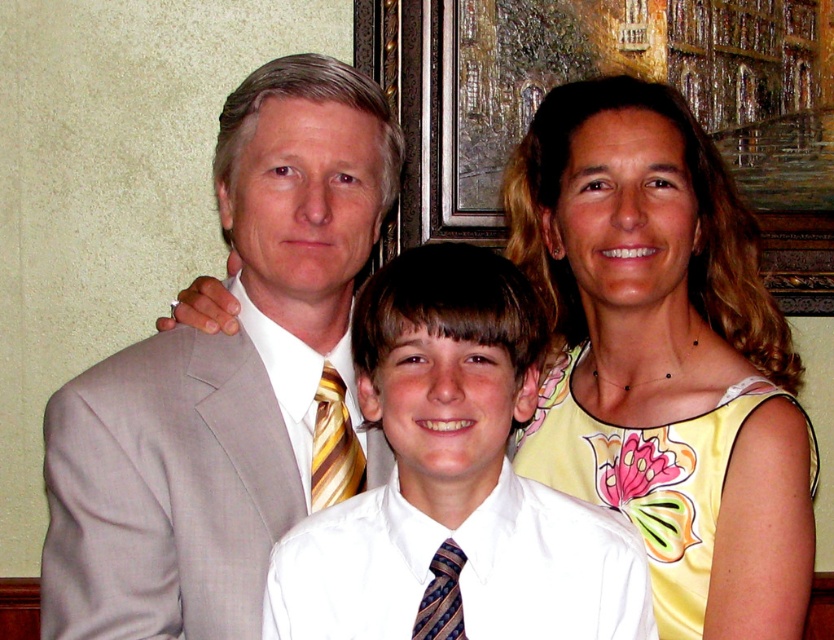
Is white satin shirt at center positioned behind multicolored silk tie at center?

No, white satin shirt at center is in front of multicolored silk tie at center.

Is white satin shirt at center taller than multicolored silk tie at center?

Yes.

I want to click on white satin shirt at center, so click(x=455, y=477).

Is light gray suit at center below yellow striped tie at center?

Incorrect, light gray suit at center is not positioned below yellow striped tie at center.

Can you confirm if light gray suit at center is positioned to the left of yellow striped tie at center?

Yes, light gray suit at center is to the left of yellow striped tie at center.

Find the location of a particular element. This screenshot has width=834, height=640. light gray suit at center is located at coordinates (220, 378).

This screenshot has height=640, width=834. In order to click on light gray suit at center in this screenshot , I will do `click(220, 378)`.

Consider the image. Does light gray suit at center have a smaller size compared to white satin shirt at center?

Actually, light gray suit at center might be larger than white satin shirt at center.

Between light gray suit at center and white satin shirt at center, which one appears on the left side from the viewer's perspective?

light gray suit at center

Find the location of a particular element. The height and width of the screenshot is (640, 834). light gray suit at center is located at coordinates tap(220, 378).

The height and width of the screenshot is (640, 834). What are the coordinates of `light gray suit at center` in the screenshot? It's located at (220, 378).